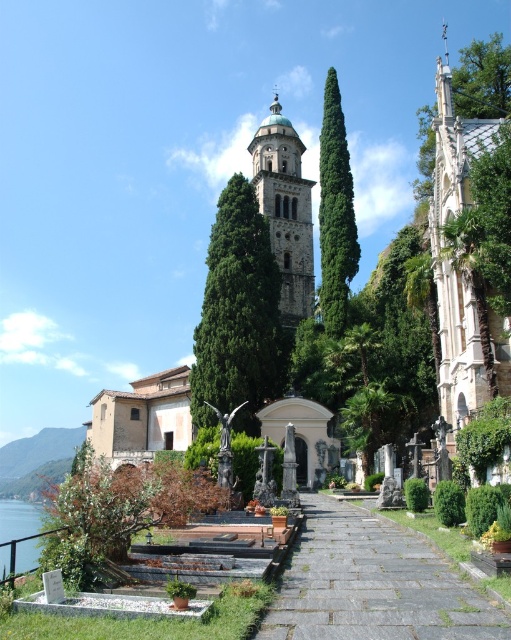
Does green leafy bush at lower left appear on the right side of stone tower at center?

Incorrect, green leafy bush at lower left is not on the right side of stone tower at center.

Between green leafy bush at lower left and stone tower at center, which one is positioned higher?

stone tower at center

Where is `green leafy bush at lower left`? Image resolution: width=511 pixels, height=640 pixels. green leafy bush at lower left is located at coordinates (96, 518).

Who is more distant from viewer, (467, 401) or (24, 525)?

The point (24, 525) is behind.

Is polished stone church at right smaller than clear water at lower left?

No, polished stone church at right is not smaller than clear water at lower left.

Identify the location of polished stone church at right. (461, 268).

Does point (83, 502) come behind point (336, 84)?

No, (83, 502) is closer to viewer.

Is green leafy bush at lower left wider than green leafy tree at center?

Correct, the width of green leafy bush at lower left exceeds that of green leafy tree at center.

Which is in front, point (88, 456) or point (331, 195)?

Point (88, 456) is in front.

Find the location of a particular element. The image size is (511, 640). green leafy bush at lower left is located at coordinates (96, 518).